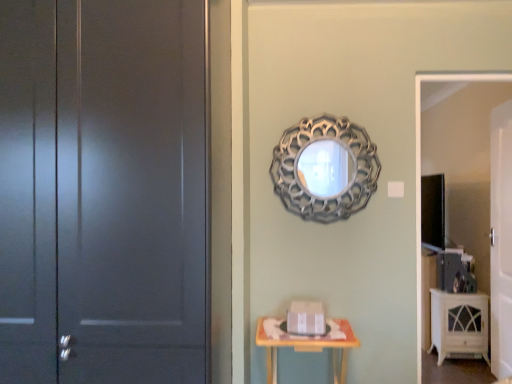
Question: Considering the relative sizes of white glossy cabinet at lower right and white glossy tv stand at right in the image provided, is white glossy cabinet at lower right wider than white glossy tv stand at right?

Choices:
 (A) no
 (B) yes

Answer: (B)

Question: Can you confirm if white glossy cabinet at lower right is smaller than white glossy tv stand at right?

Choices:
 (A) no
 (B) yes

Answer: (A)

Question: Does white glossy cabinet at lower right touch white glossy tv stand at right?

Choices:
 (A) yes
 (B) no

Answer: (B)

Question: Is white glossy cabinet at lower right looking in the opposite direction of white glossy tv stand at right?

Choices:
 (A) no
 (B) yes

Answer: (A)

Question: Can you confirm if white glossy cabinet at lower right is taller than white glossy tv stand at right?

Choices:
 (A) yes
 (B) no

Answer: (B)

Question: Can we say white glossy cabinet at lower right lies outside white glossy tv stand at right?

Choices:
 (A) no
 (B) yes

Answer: (B)

Question: Are matte gray door at left, the first door viewed from the left, and white glossy cabinet at lower right located far from each other?

Choices:
 (A) yes
 (B) no

Answer: (A)

Question: Is matte gray door at left, which is counted as the 2th door, starting from the right, thinner than white glossy cabinet at lower right?

Choices:
 (A) no
 (B) yes

Answer: (A)

Question: Is the surface of matte gray door at left, the first door viewed from the left, in direct contact with white glossy cabinet at lower right?

Choices:
 (A) no
 (B) yes

Answer: (A)

Question: Does matte gray door at left, the first door viewed from the left, appear on the right side of white glossy cabinet at lower right?

Choices:
 (A) no
 (B) yes

Answer: (A)

Question: Is white glossy cabinet at lower right a part of matte gray door at left, which is counted as the 2th door, starting from the right?

Choices:
 (A) no
 (B) yes

Answer: (A)

Question: Would you say matte gray door at left, which is counted as the 2th door, starting from the right, is outside white glossy cabinet at lower right?

Choices:
 (A) no
 (B) yes

Answer: (B)

Question: From a real-world perspective, is matte gray door at left, the second door in the back-to-front sequence, positioned over silver metallic mirror at upper center based on gravity?

Choices:
 (A) no
 (B) yes

Answer: (A)